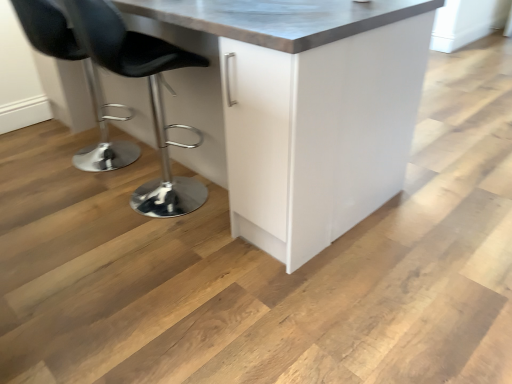
Question: Is black leather stool at left, the second chair viewed from the right, inside the boundaries of white glossy cabinet at center, or outside?

Choices:
 (A) outside
 (B) inside

Answer: (B)

Question: Relative to white glossy cabinet at center, is black leather stool at left, the first chair in the left-to-right sequence, in front or behind?

Choices:
 (A) front
 (B) behind

Answer: (B)

Question: Estimate the real-world distances between objects in this image. Which object is farther from the white glossy cabinet at center?

Choices:
 (A) black leather stool at left, arranged as the first chair when viewed from the right
 (B) black leather stool at left, the second chair viewed from the right

Answer: (B)

Question: Which object is the closest to the white glossy cabinet at center?

Choices:
 (A) black leather stool at left, the first chair in the left-to-right sequence
 (B) black leather stool at left, arranged as the 2th chair when viewed from the left

Answer: (B)